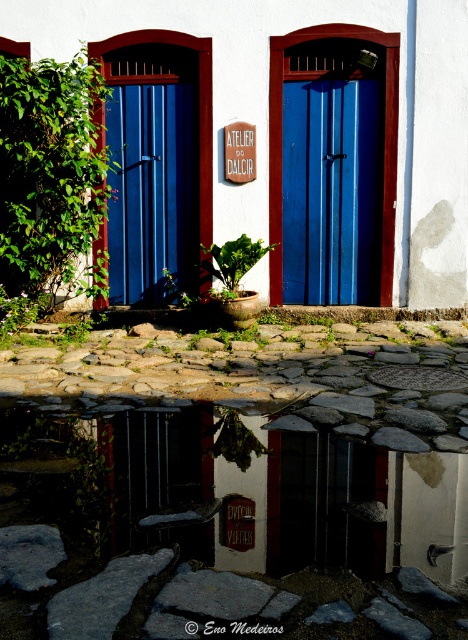
Question: Which object is farther from the camera taking this photo?

Choices:
 (A) green leafy plant at lower left
 (B) green matte plant at center

Answer: (B)

Question: Which of the following is the farthest from the observer?

Choices:
 (A) blue painted wood door at center
 (B) green leafy plant at lower left
 (C) green matte plant at center

Answer: (A)

Question: Does green leafy plant at left have a lesser width compared to green leafy plant at center?

Choices:
 (A) no
 (B) yes

Answer: (A)

Question: Among these points, which one is farthest from the camera?

Choices:
 (A) (23, 310)
 (B) (306, 106)
 (C) (146, 269)
 (D) (207, 250)

Answer: (C)

Question: Does green leafy plant at left have a lesser width compared to green matte plant at center?

Choices:
 (A) no
 (B) yes

Answer: (A)

Question: Is green leafy plant at left wider than blue painted wood door at center?

Choices:
 (A) no
 (B) yes

Answer: (B)